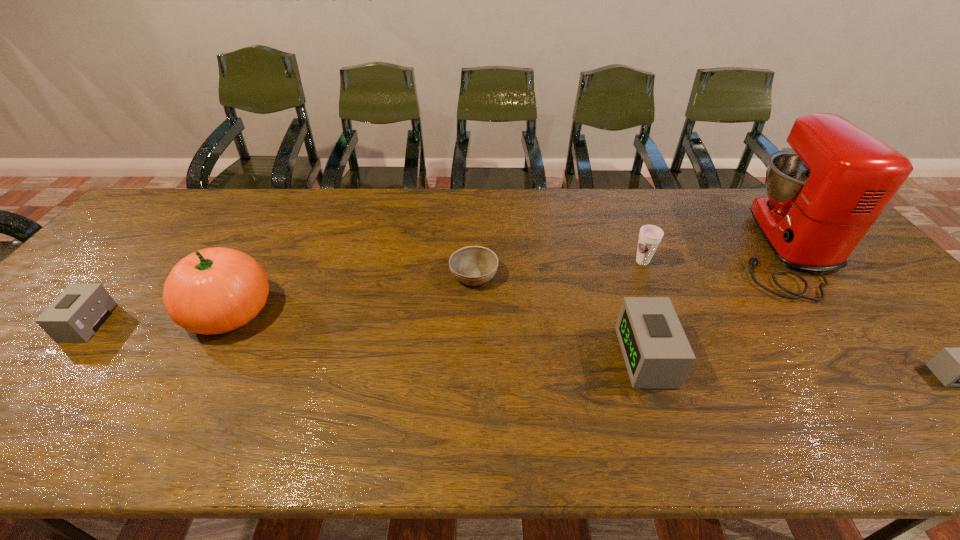
At what (x,y) coordinates should I click in order to perform the action: click on object present at the near edge. Please return your answer as a coordinate pair (x, y). The height and width of the screenshot is (540, 960). Looking at the image, I should click on (656, 351).

You are a GUI agent. You are given a task and a screenshot of the screen. Output one action in this format:
    pyautogui.click(x=<x>, y=<y>)
    Task: Click on the object that is at the left edge
    
    Given the screenshot: What is the action you would take?
    pyautogui.click(x=81, y=309)

I want to click on object positioned at the right edge, so click(823, 195).

Find the location of a particular element. The height and width of the screenshot is (540, 960). object located at the far right corner is located at coordinates (823, 195).

The height and width of the screenshot is (540, 960). In the image, there is a desktop. In order to click on free space at the far edge in this screenshot , I will do `click(200, 218)`.

Locate an element on the screen. The height and width of the screenshot is (540, 960). free space at the near edge of the desktop is located at coordinates (347, 392).

The image size is (960, 540). What are the coordinates of `vacant space at the right edge of the desktop` in the screenshot? It's located at (864, 301).

Identify the location of vacant space at the near left corner of the desktop. (40, 380).

Identify the location of free space between the cup and the bowl. This screenshot has width=960, height=540. (558, 268).

This screenshot has height=540, width=960. Identify the location of vacant space in between the cup and the second object from left to right. (436, 287).